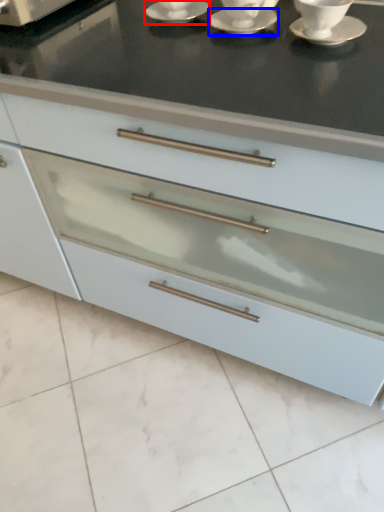
Question: Which of the following is the farthest to the observer, saucer (highlighted by a red box) or saucer (highlighted by a blue box)?

Choices:
 (A) saucer
 (B) saucer

Answer: (A)